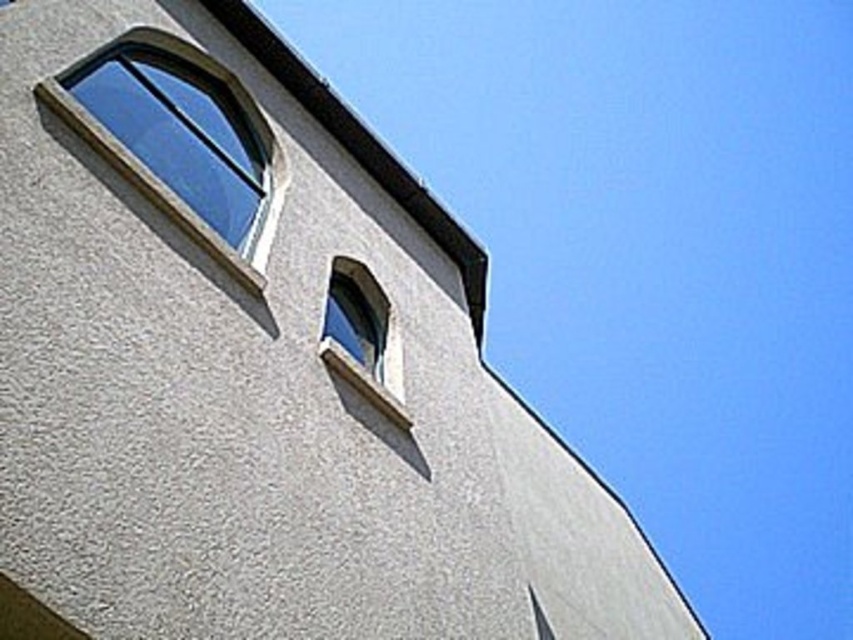
Question: Does clear glass window at upper left have a larger size compared to clear glass window at upper center?

Choices:
 (A) no
 (B) yes

Answer: (B)

Question: Is clear glass window at upper left below clear glass window at upper center?

Choices:
 (A) yes
 (B) no

Answer: (B)

Question: Which point is farther to the camera?

Choices:
 (A) clear glass window at upper left
 (B) clear glass window at upper center

Answer: (B)

Question: Which of the following is the farthest from the observer?

Choices:
 (A) clear glass window at upper left
 (B) clear glass window at upper center

Answer: (B)

Question: Does clear glass window at upper left appear over clear glass window at upper center?

Choices:
 (A) no
 (B) yes

Answer: (B)

Question: Which of the following is the closest to the observer?

Choices:
 (A) clear glass window at upper center
 (B) clear glass window at upper left

Answer: (B)